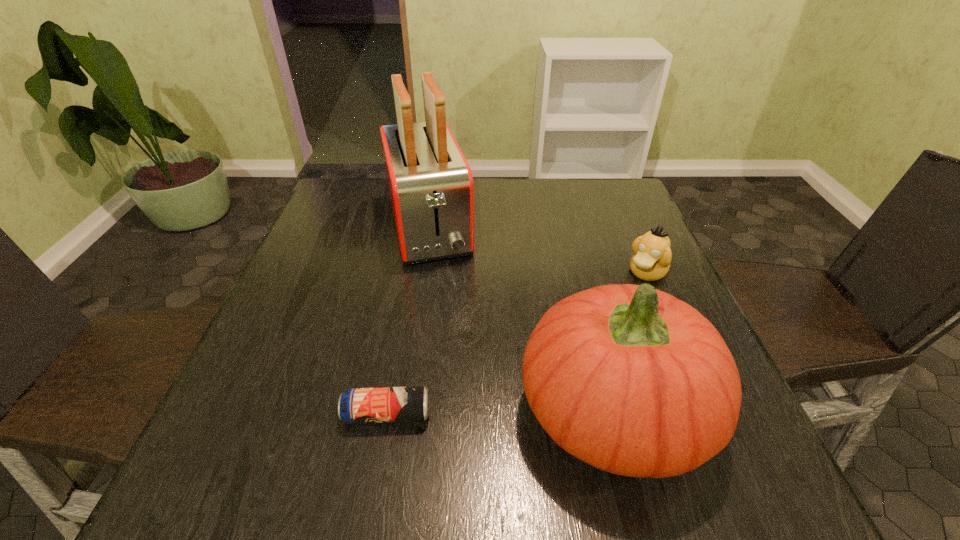
I want to click on the shortest object, so click(385, 404).

You are a GUI agent. You are given a task and a screenshot of the screen. Output one action in this format:
    pyautogui.click(x=<x>, y=<y>)
    Task: Click on the pumpkin
    
    Given the screenshot: What is the action you would take?
    pyautogui.click(x=627, y=378)

Where is `duckling`? The width and height of the screenshot is (960, 540). duckling is located at coordinates (652, 256).

Locate an element on the screen. The height and width of the screenshot is (540, 960). the tallest object is located at coordinates (430, 183).

Find the location of a particular element. vacant point located on the back of the beer can is located at coordinates (407, 307).

Locate an element on the screen. The height and width of the screenshot is (540, 960). free space located on the back of the pumpkin is located at coordinates tap(578, 269).

This screenshot has width=960, height=540. I want to click on free space located 0.240m on the face of the third tallest object, so click(580, 346).

You are a GUI agent. You are given a task and a screenshot of the screen. Output one action in this format:
    pyautogui.click(x=<x>, y=<y>)
    Task: Click on the vacant position located on the face of the third tallest object
    
    Given the screenshot: What is the action you would take?
    pyautogui.click(x=600, y=323)

This screenshot has height=540, width=960. Identify the location of free space located on the face of the third tallest object. (538, 390).

This screenshot has width=960, height=540. Identify the location of vacant space located 0.340m on the front-facing side of the toaster. (468, 387).